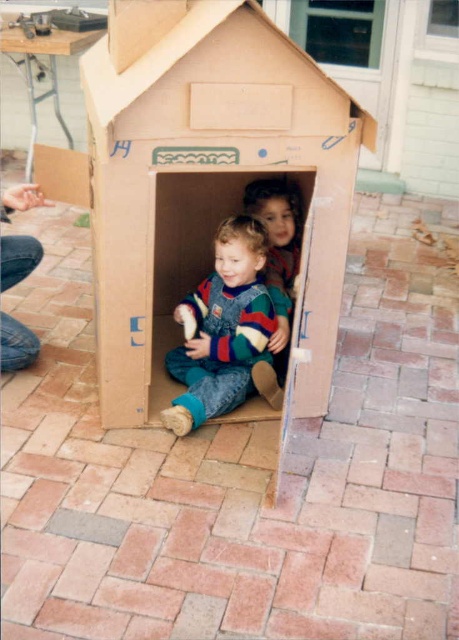
Which is more to the left, matte blue overalls at center or striped sweater at center?

From the viewer's perspective, matte blue overalls at center appears more on the left side.

Consider the image. Which is more to the right, matte blue overalls at center or striped sweater at center?

Positioned to the right is striped sweater at center.

Is point (190, 388) farther from viewer compared to point (279, 317)?

No, it is not.

Identify the location of matte blue overalls at center. Image resolution: width=459 pixels, height=640 pixels. pos(223,330).

From the picture: Who is shorter, cardboard house at center or matte blue overalls at center?

matte blue overalls at center is shorter.

Between cardboard house at center and matte blue overalls at center, which one is positioned lower?

matte blue overalls at center is lower down.

Who is more distant from viewer, (244, 45) or (166, 410)?

Point (166, 410)

Locate an element on the screen. cardboard house at center is located at coordinates (207, 195).

Does cardboard house at center appear on the left side of striped sweater at center?

Correct, you'll find cardboard house at center to the left of striped sweater at center.

The image size is (459, 640). What are the coordinates of `cardboard house at center` in the screenshot? It's located at (207, 195).